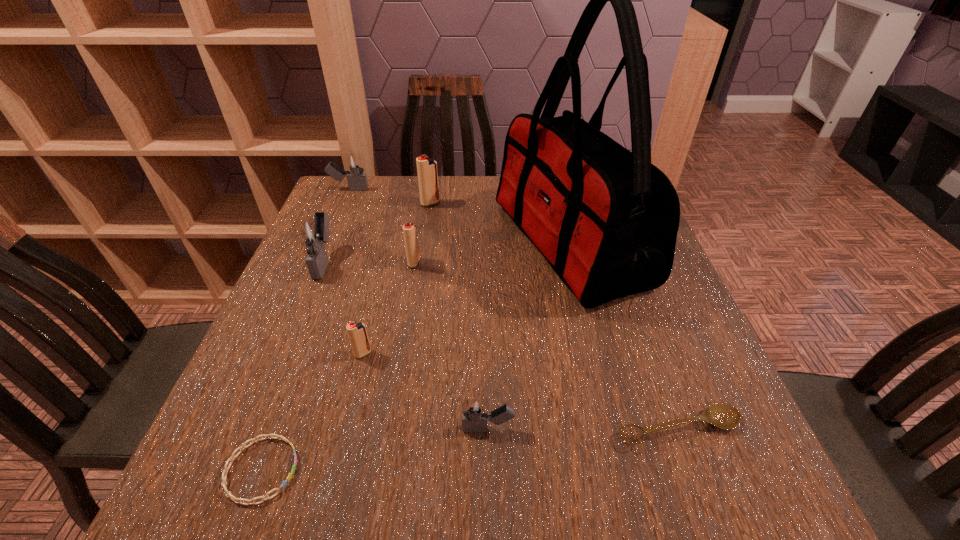
Find the location of `vacant space positioned on the front of the nearest red igniter`. vacant space positioned on the front of the nearest red igniter is located at coordinates (325, 506).

You are a GUI agent. You are given a task and a screenshot of the screen. Output one action in this format:
    pyautogui.click(x=<x>, y=<y>)
    Task: Click on the vacant space located 0.270m on the back of the nearest gray igniter
    The image size is (960, 540).
    Given the screenshot: What is the action you would take?
    pyautogui.click(x=486, y=305)

Image resolution: width=960 pixels, height=540 pixels. What are the coordinates of `vacant area situated 0.080m on the left of the ladle` in the screenshot? It's located at (567, 428).

Image resolution: width=960 pixels, height=540 pixels. I want to click on vacant region located on the surface of the shortest object showing star-shaped elements, so click(x=448, y=470).

Where is `duffel bag at the far edge`? The image size is (960, 540). duffel bag at the far edge is located at coordinates (606, 219).

Where is `object located in the near edge section of the desktop`? This screenshot has width=960, height=540. object located in the near edge section of the desktop is located at coordinates (237, 500).

Find the location of a particular element. bracelet present at the left edge is located at coordinates (237, 500).

Where is `duffel bag that is at the right edge`? The image size is (960, 540). duffel bag that is at the right edge is located at coordinates (606, 219).

Image resolution: width=960 pixels, height=540 pixels. I want to click on ladle located at the right edge, so click(724, 416).

Identify the location of object that is positioned at the far left corner. (353, 163).